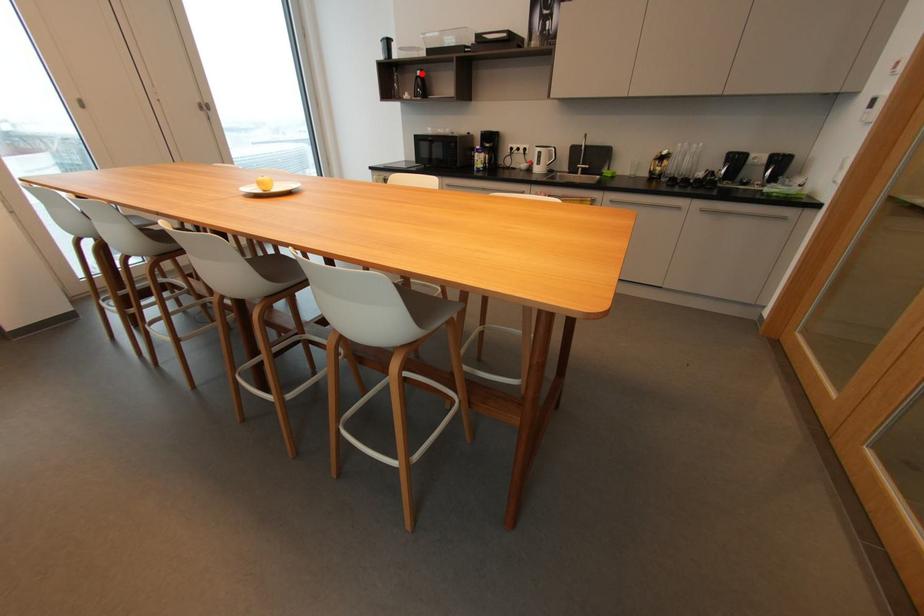
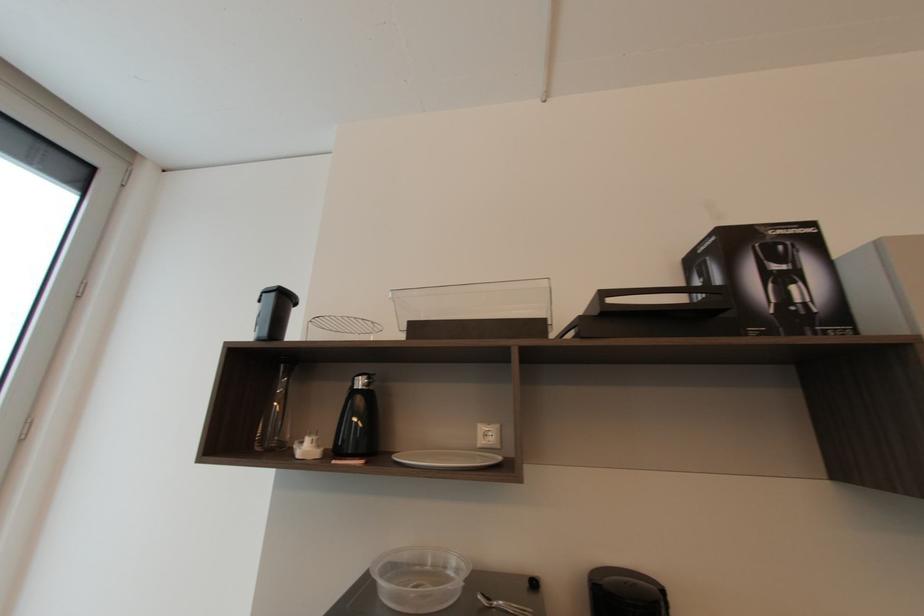
Find the pixel in the second image that matches the highlighted location in the first image.

(362, 384)